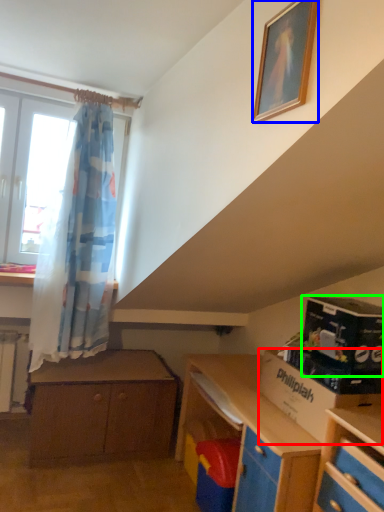
Question: Considering the real-world distances, which object is farthest from cardboard box (highlighted by a red box)? picture frame (highlighted by a blue box) or box (highlighted by a green box)?

Choices:
 (A) picture frame
 (B) box

Answer: (A)